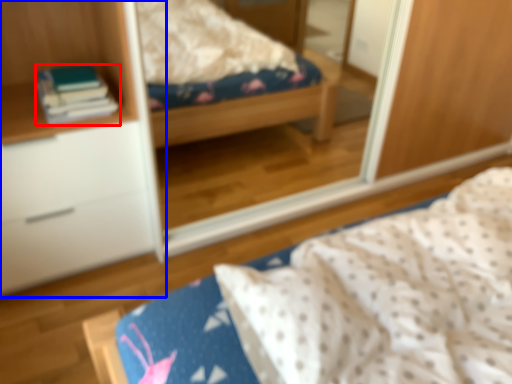
Question: Which object is closer to the camera taking this photo, book (highlighted by a red box) or cabinetry (highlighted by a blue box)?

Choices:
 (A) book
 (B) cabinetry

Answer: (B)